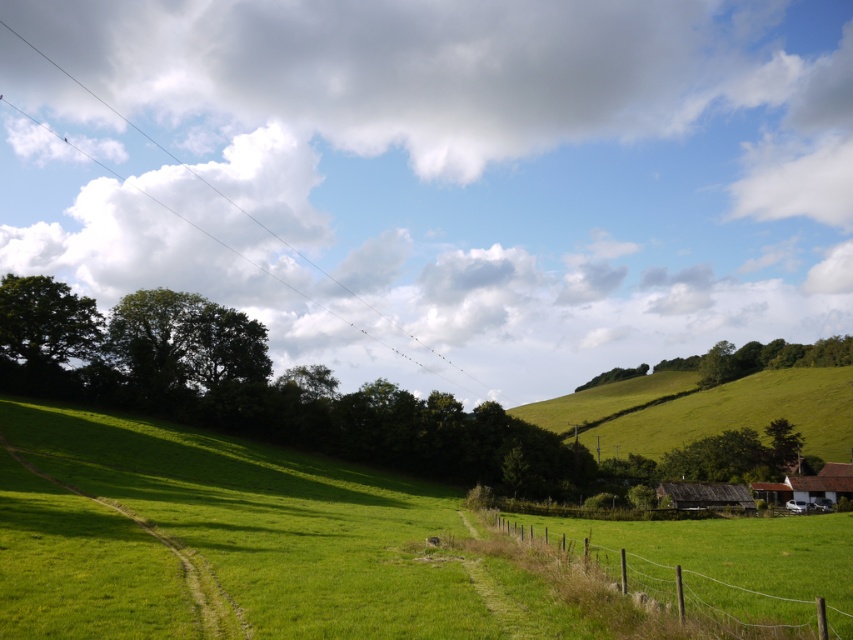
Between point (643, 580) and point (624, 442), which one is positioned in front?

Point (643, 580) is more forward.

Find the location of a particular element. This screenshot has height=640, width=853. wire mesh fence at lower right is located at coordinates (727, 561).